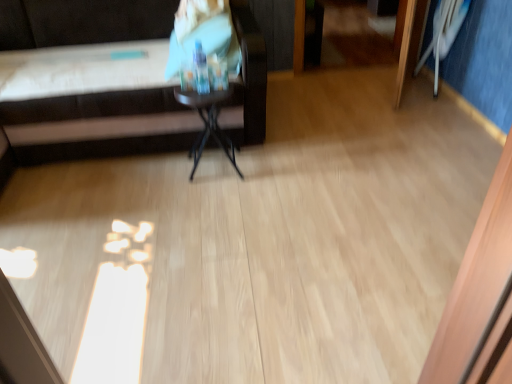
Where is `free location to the right of black glossy side table at center`? free location to the right of black glossy side table at center is located at coordinates (266, 170).